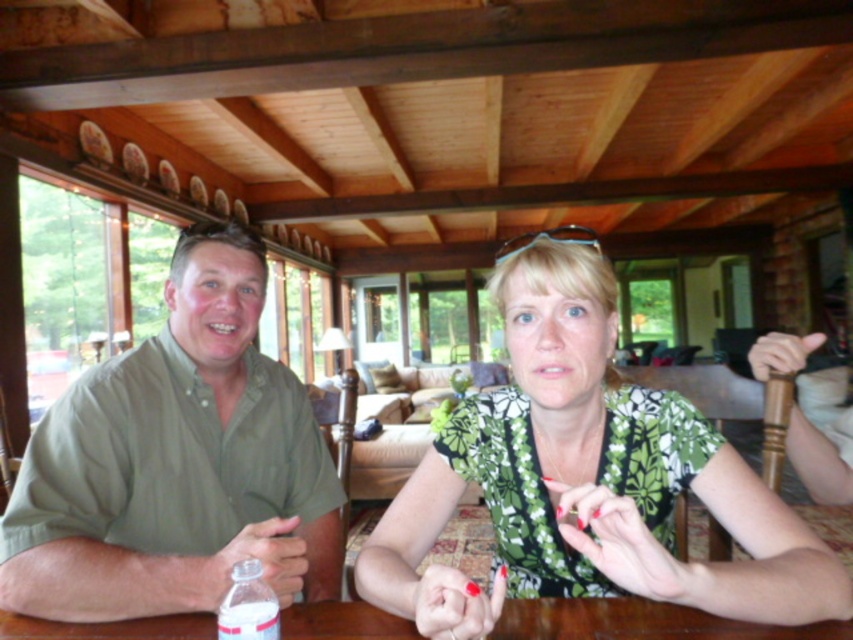
Question: Which point is farther from the camera taking this photo?

Choices:
 (A) (260, 612)
 (B) (184, 541)
 (C) (556, 637)
 (D) (469, 416)

Answer: (B)

Question: Is green floral blouse at center smaller than white plastic bottle at lower left?

Choices:
 (A) yes
 (B) no

Answer: (B)

Question: Which point is closer to the camera taking this photo?

Choices:
 (A) coord(648,436)
 (B) coord(544,625)
 (C) coord(218,614)

Answer: (C)

Question: Is green floral blouse at center smaller than white plastic bottle at lower left?

Choices:
 (A) no
 (B) yes

Answer: (A)

Question: Estimate the real-world distances between objects in this image. Which object is closer to the white plastic bottle at lower left?

Choices:
 (A) green cotton shirt at left
 (B) brown wooden table at center
 (C) green floral blouse at center

Answer: (B)

Question: Can you confirm if green cotton shirt at left is smaller than white plastic bottle at lower left?

Choices:
 (A) yes
 (B) no

Answer: (B)